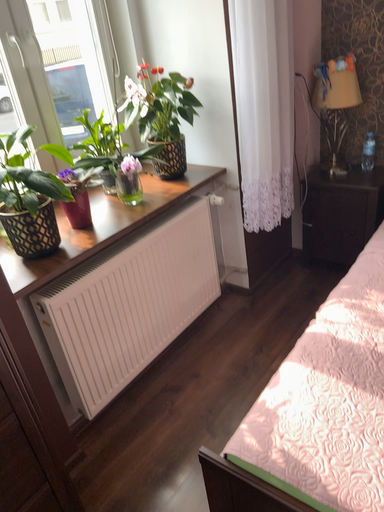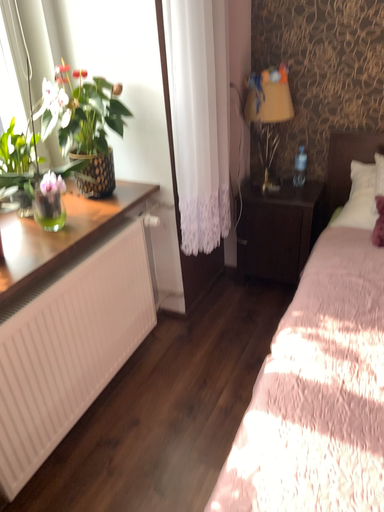
Question: How did the camera likely rotate when shooting the video?

Choices:
 (A) rotated left
 (B) rotated right

Answer: (B)